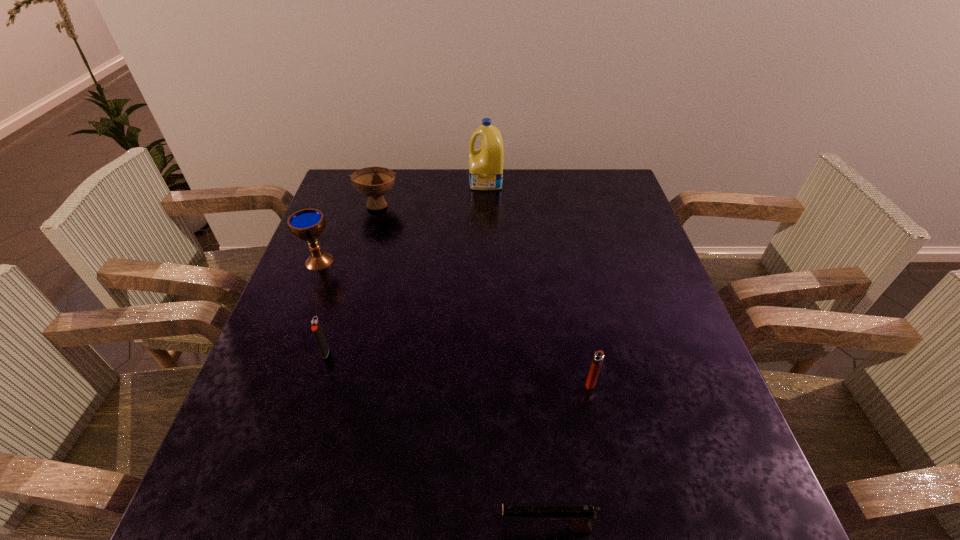
Locate an element on the screen. the farthest object is located at coordinates (485, 163).

What are the coordinates of `detergent` in the screenshot? It's located at (485, 163).

Locate an element on the screen. The image size is (960, 540). chalice is located at coordinates (307, 224).

Where is `the leftmost object`? the leftmost object is located at coordinates (307, 224).

Where is `soup bowl`? This screenshot has width=960, height=540. soup bowl is located at coordinates (374, 182).

Locate an element on the screen. The image size is (960, 540). the third nearest object is located at coordinates (316, 328).

I want to click on the left igniter, so click(x=316, y=328).

Find the location of a particular element. the right igniter is located at coordinates (598, 357).

Identify the location of the rightmost object. The height and width of the screenshot is (540, 960). (598, 357).

The height and width of the screenshot is (540, 960). What are the coordinates of `pistol` in the screenshot? It's located at (578, 516).